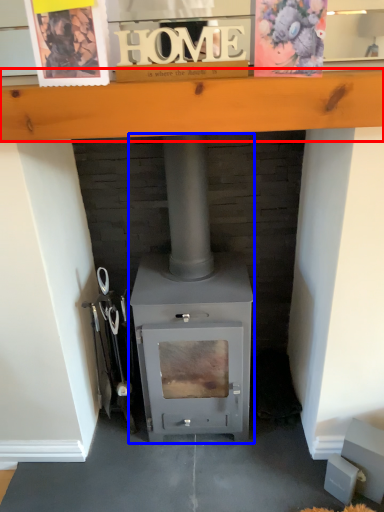
Question: Which object is further to the camera taking this photo, ledge (highlighted by a red box) or wood burning stove (highlighted by a blue box)?

Choices:
 (A) ledge
 (B) wood burning stove

Answer: (B)